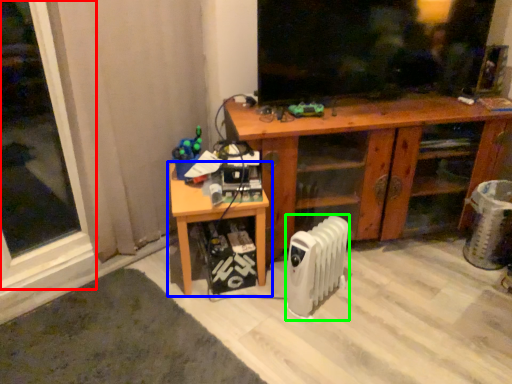
Question: Which is nearer to the window (highlighted by a red box)? table (highlighted by a blue box) or radiator (highlighted by a green box).

Choices:
 (A) table
 (B) radiator

Answer: (A)